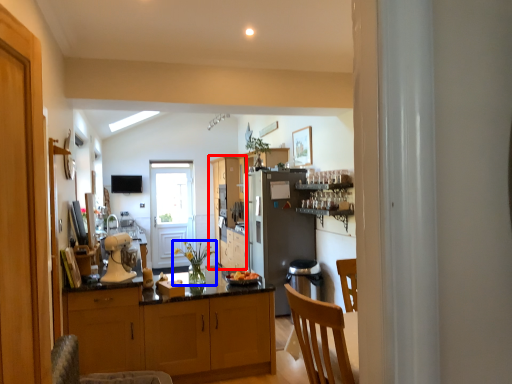
Question: Which of the following is the farthest to the observer, cabinetry (highlighted by a red box) or houseplant (highlighted by a blue box)?

Choices:
 (A) cabinetry
 (B) houseplant

Answer: (A)